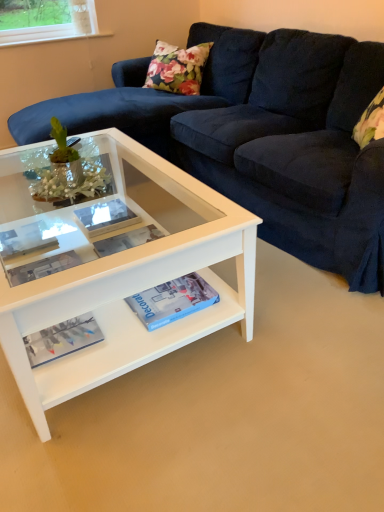
What are the coordinates of `vacant region above matte white paperback book at center, placed as the 2th paperback book when sorted from front to back (from a real-world perspective)` in the screenshot? It's located at tap(100, 216).